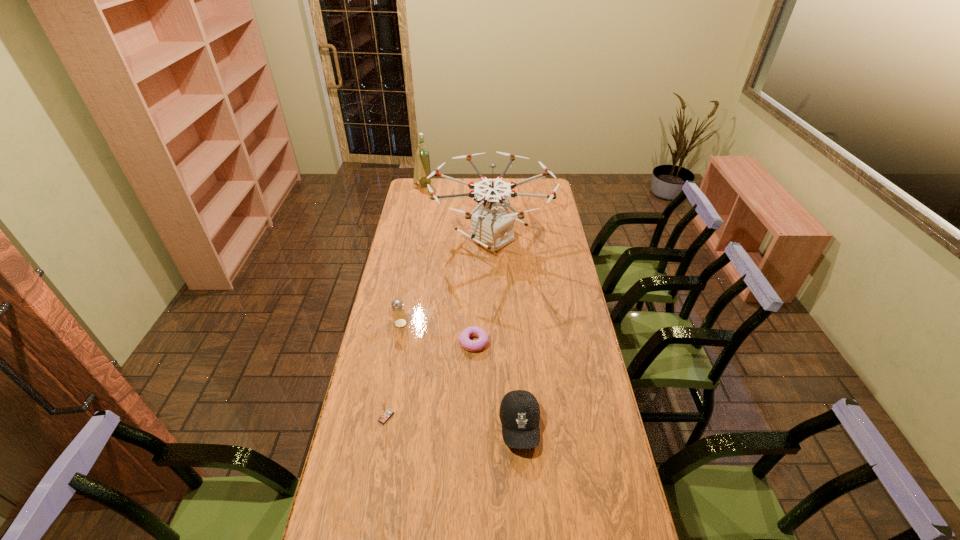
Image resolution: width=960 pixels, height=540 pixels. In order to click on free location that satisfies the following two spatial constraints: 1. on the back side of the saltshaker; 2. on the front-facing side of the farthest object in this screenshot , I will do `click(426, 186)`.

The image size is (960, 540). Identify the location of free spot that satisfies the following two spatial constraints: 1. on the back side of the second farthest object; 2. on the right side of the matchbox. (419, 239).

This screenshot has width=960, height=540. Identify the location of free location that satisfies the following two spatial constraints: 1. on the back side of the matchbox; 2. on the right side of the drone. (419, 239).

Find the location of `free space in the image that satisfies the following two spatial constraints: 1. on the front-facing side of the wine bottle; 2. on the right side of the matchbox`. free space in the image that satisfies the following two spatial constraints: 1. on the front-facing side of the wine bottle; 2. on the right side of the matchbox is located at coordinates (378, 417).

Identify the location of vacant point that satisfies the following two spatial constraints: 1. on the front-facing side of the farthest object; 2. on the right side of the third farthest object. The image size is (960, 540). (396, 323).